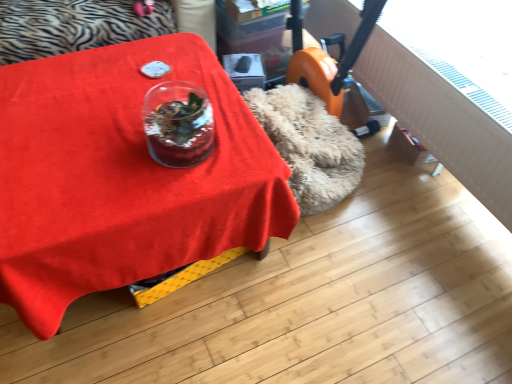
The width and height of the screenshot is (512, 384). I want to click on vacant area on top of matte red tablecloth at center (from a real-world perspective), so click(98, 129).